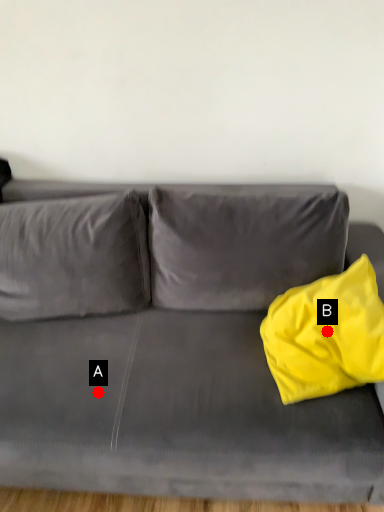
Question: Two points are circled on the image, labeled by A and B beside each circle. Which of the following is the closest to the observer?

Choices:
 (A) A is closer
 (B) B is closer

Answer: (A)